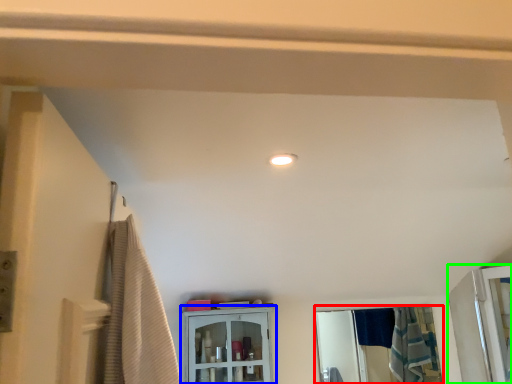
Question: Based on their relative distances, which object is nearer to mirror (highlighted by a red box)? Choose from cabinetry (highlighted by a blue box) and screen door (highlighted by a green box).

Choices:
 (A) cabinetry
 (B) screen door

Answer: (B)